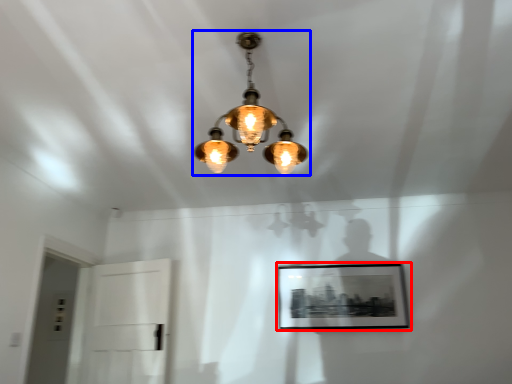
Question: Which object appears farthest to the camera in this image, picture frame (highlighted by a red box) or lamp (highlighted by a blue box)?

Choices:
 (A) picture frame
 (B) lamp

Answer: (A)